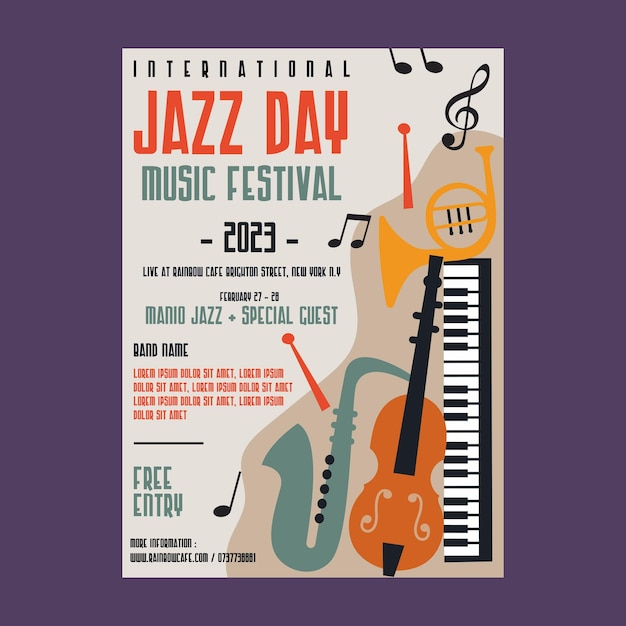
Locate an element on the screen. digital poster is located at coordinates (313, 218).